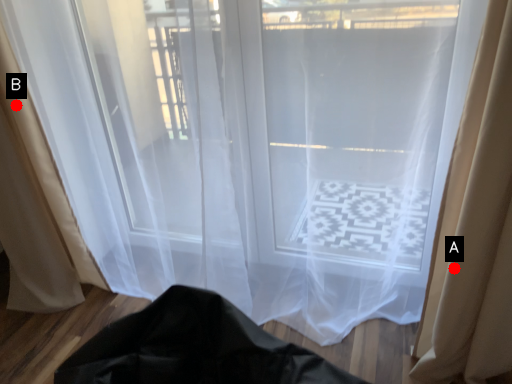
Question: Two points are circled on the image, labeled by A and B beside each circle. Among these points, which one is nearest to the camera?

Choices:
 (A) A is closer
 (B) B is closer

Answer: (A)